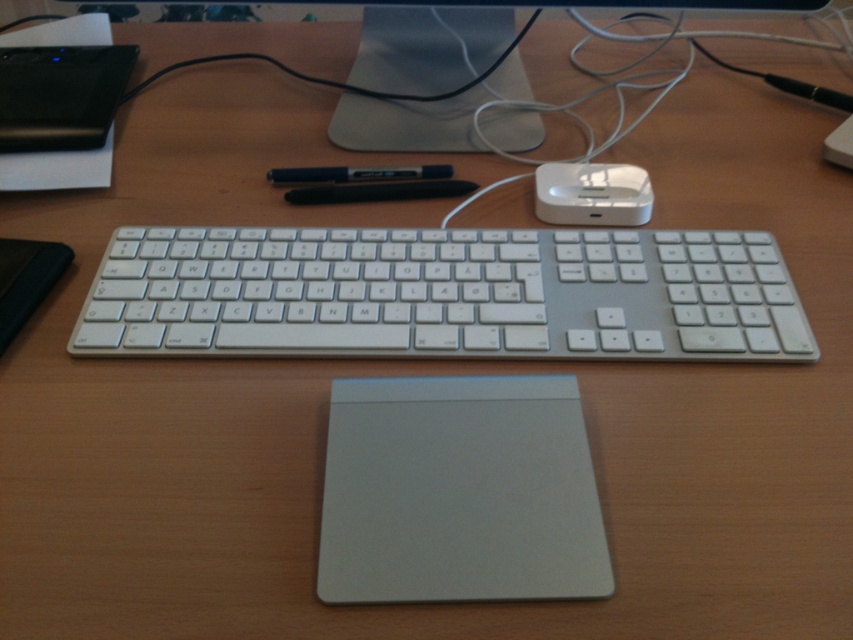
Question: Is the position of silver aluminum keyboard at center less distant than that of satin silver monitor at upper center?

Choices:
 (A) no
 (B) yes

Answer: (B)

Question: Can you confirm if silver metallic mouse at center is bigger than black rubber pen at center?

Choices:
 (A) no
 (B) yes

Answer: (B)

Question: Considering the relative positions of black rubber pen at center and black glossy pen at center in the image provided, where is black rubber pen at center located with respect to black glossy pen at center?

Choices:
 (A) above
 (B) below

Answer: (B)

Question: Among these points, which one is nearest to the camera?

Choices:
 (A) (109, 294)
 (B) (399, 112)
 (C) (292, 168)

Answer: (A)

Question: Which of the following is the closest to the observer?

Choices:
 (A) black rubber pen at center
 (B) black plastic external hard drive at upper left
 (C) satin silver monitor at upper center

Answer: (A)

Question: Among these objects, which one is nearest to the camera?

Choices:
 (A) satin silver monitor at upper center
 (B) black rubber pen at center
 (C) silver metallic mouse at center
 (D) silver aluminum keyboard at center

Answer: (C)